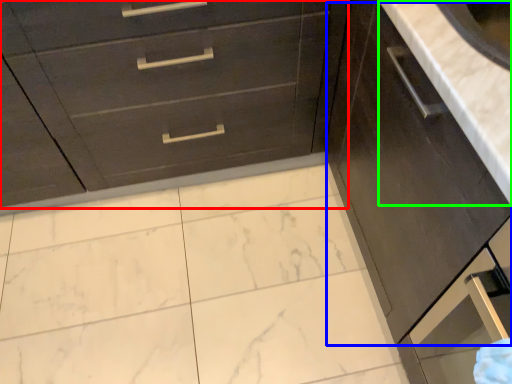
Question: Which is nearer to the chest of drawers (highlighted by a red box)? cabinetry (highlighted by a blue box) or counter top (highlighted by a green box).

Choices:
 (A) cabinetry
 (B) counter top

Answer: (A)